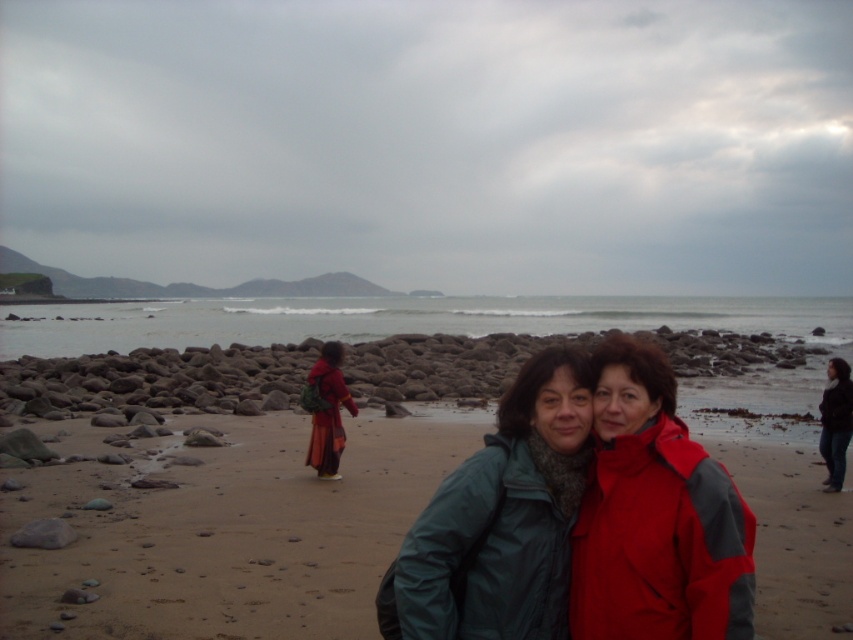
Can you confirm if green matte jacket at center is smaller than dark blue jeans at lower right?

Yes.

Is point (598, 358) less distant than point (824, 486)?

Yes, it is.

At what (x,y) coordinates should I click in order to perform the action: click on green matte jacket at center. Please return your answer as a coordinate pair (x, y). The width and height of the screenshot is (853, 640). Looking at the image, I should click on (654, 516).

Is point (608, 628) farther from viewer compared to point (335, 412)?

No, (608, 628) is in front of (335, 412).

Does green matte jacket at center have a greater height compared to matte orange dress at center?

Incorrect, green matte jacket at center's height is not larger of matte orange dress at center's.

Is point (648, 426) positioned behind point (325, 435)?

That is False.

Find the location of a particular element. The image size is (853, 640). green matte jacket at center is located at coordinates (654, 516).

Can you confirm if green matte jacket at center is smaller than clear water at center?

Correct, green matte jacket at center occupies less space than clear water at center.

Which is in front, point (608, 579) or point (581, 326)?

Positioned in front is point (608, 579).

Find the location of a particular element. The image size is (853, 640). green matte jacket at center is located at coordinates (654, 516).